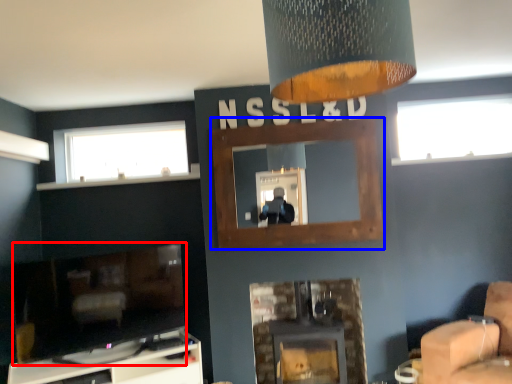
Question: Which object appears farthest to the camera in this image, fireplace (highlighted by a red box) or fireplace (highlighted by a blue box)?

Choices:
 (A) fireplace
 (B) fireplace

Answer: (B)